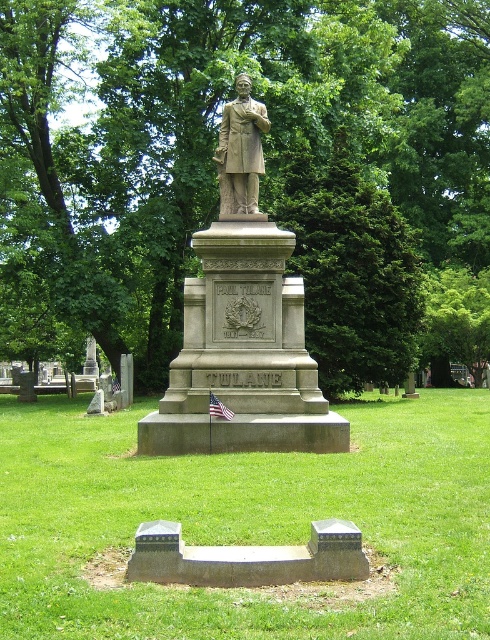
You are standing in front of the Paul Tulane monument and notice a green leafy tree at center and a bronze statue at center. Which object is positioned to the right of the other?

The green leafy tree at center is to the right of the bronze statue at center.

You are visiting the Paul Tulane monument and want to sit on the smooth concrete bench at center while facing the monument. Where should you position yourself relative to the green leafy tree at center?

You should position yourself to the left of the green leafy tree at center because the bench is to the left of the tree, so facing the monument would place the tree to your right.